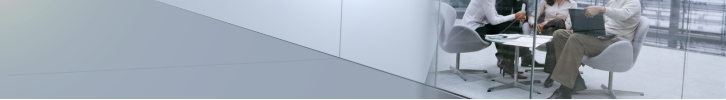
What are the coordinates of `glass partitions` in the screenshot? It's located at (399, 41), (491, 47), (616, 56), (709, 55).